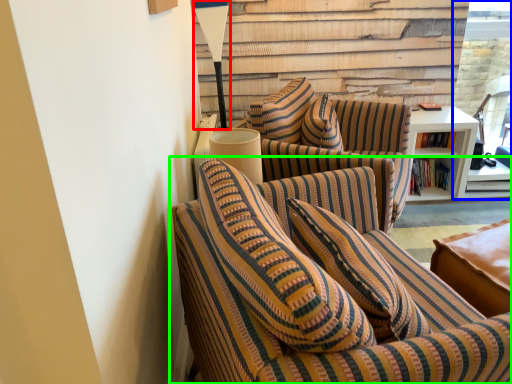
Question: Which is farther away from table lamp (highlighted by a red box)? glass door (highlighted by a blue box) or studio couch (highlighted by a green box)?

Choices:
 (A) glass door
 (B) studio couch

Answer: (A)